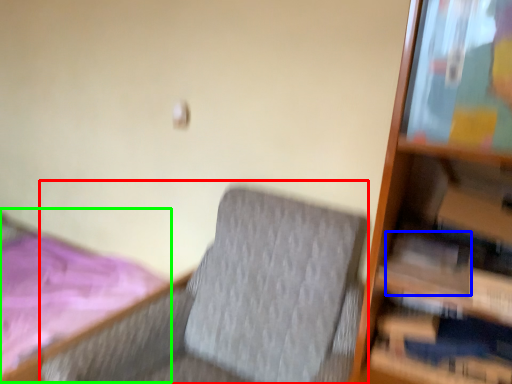
Question: Considering the real-world distances, which object is closest to rocking chair (highlighted by a red box)? paperback book (highlighted by a blue box) or bed (highlighted by a green box).

Choices:
 (A) paperback book
 (B) bed

Answer: (A)